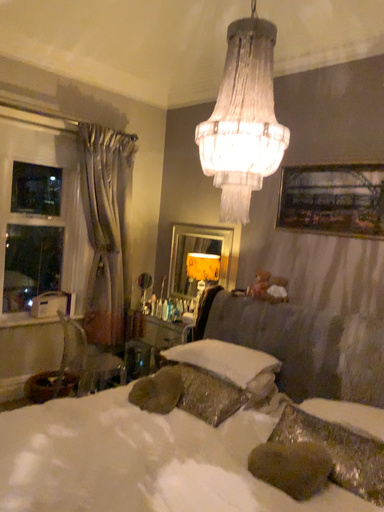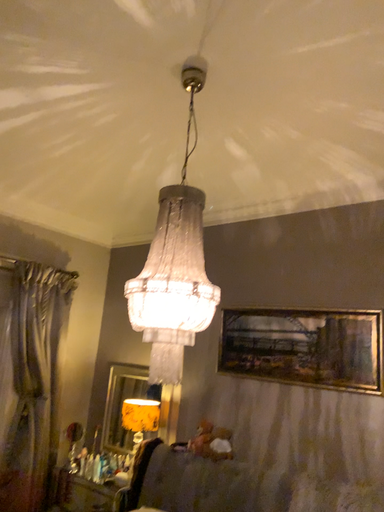
Question: Which way did the camera rotate in the video?

Choices:
 (A) rotated right
 (B) rotated left

Answer: (A)